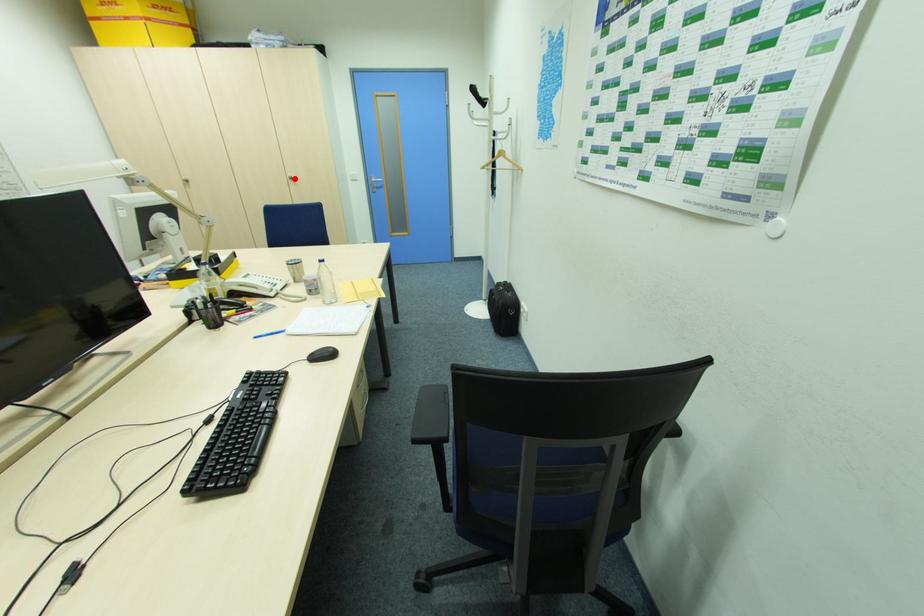
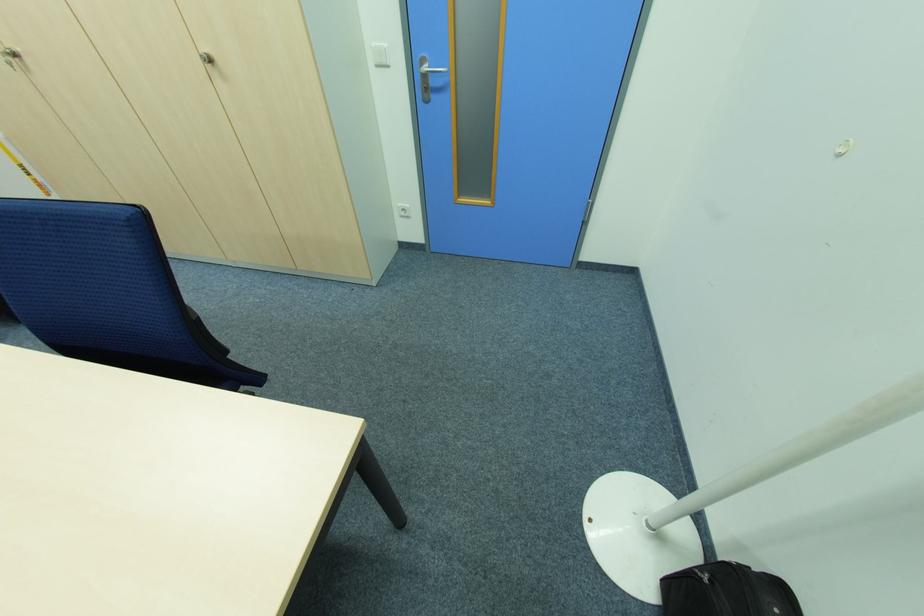
Question: I am providing you with two images of the same scene from different viewpoints. In image1, a red point is highlighted. Considering the same 3D point in image2, which of the following is correct?

Choices:
 (A) It is closer
 (B) It is farther

Answer: (B)